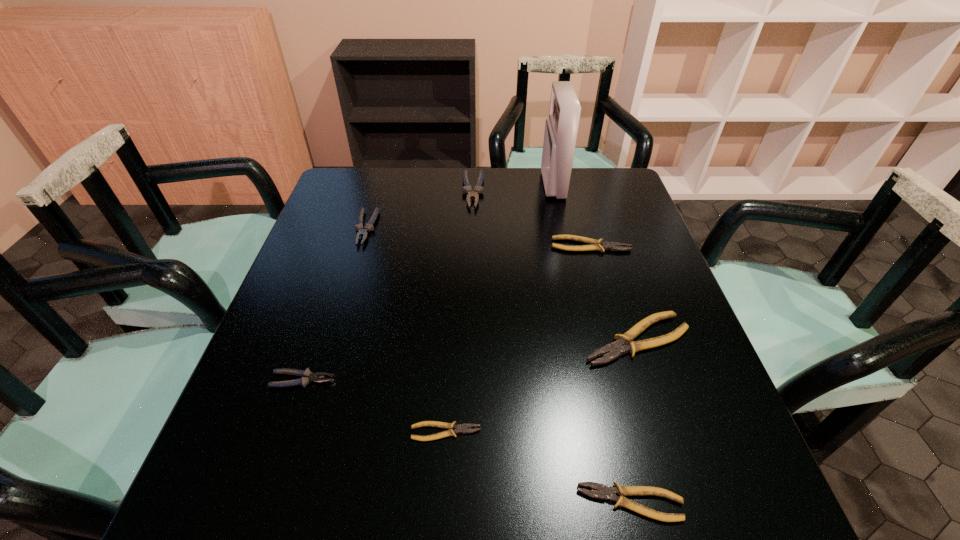
The image size is (960, 540). I want to click on blank space at the left edge of the desktop, so pyautogui.click(x=273, y=341).

This screenshot has height=540, width=960. What are the coordinates of `free space at the right edge` in the screenshot? It's located at (625, 228).

This screenshot has height=540, width=960. I want to click on vacant space at the far right corner, so click(584, 169).

You are a GUI agent. You are given a task and a screenshot of the screen. Output one action in this format:
    pyautogui.click(x=<x>, y=<y>)
    Task: Click on the vacant area that lies between the first-aid kit and the fourth nearest pliers
    
    Given the screenshot: What is the action you would take?
    pyautogui.click(x=595, y=262)

At what (x,y) coordinates should I click in order to perform the action: click on vacant area between the tallest object and the rightmost gray pliers. Please return your answer as a coordinate pair (x, y). Image resolution: width=960 pixels, height=540 pixels. Looking at the image, I should click on (513, 188).

You are a GUI agent. You are given a task and a screenshot of the screen. Output one action in this format:
    pyautogui.click(x=<x>, y=<y>)
    Task: Click on the free point between the tallest pliers and the shortest object
    
    Given the screenshot: What is the action you would take?
    pyautogui.click(x=460, y=312)

Where is `free space that is in between the fourth nearest pliers and the second shortest pliers`? The image size is (960, 540). free space that is in between the fourth nearest pliers and the second shortest pliers is located at coordinates (634, 421).

Find the location of a particular element. This screenshot has width=960, height=540. free space between the second biggest gray pliers and the tallest object is located at coordinates (459, 207).

Locate an element on the screen. empty space that is in between the second farthest yellow pliers and the tallest pliers is located at coordinates (555, 266).

Image resolution: width=960 pixels, height=540 pixels. I want to click on vacant area that lies between the leftmost yellow pliers and the fourth nearest pliers, so click(541, 386).